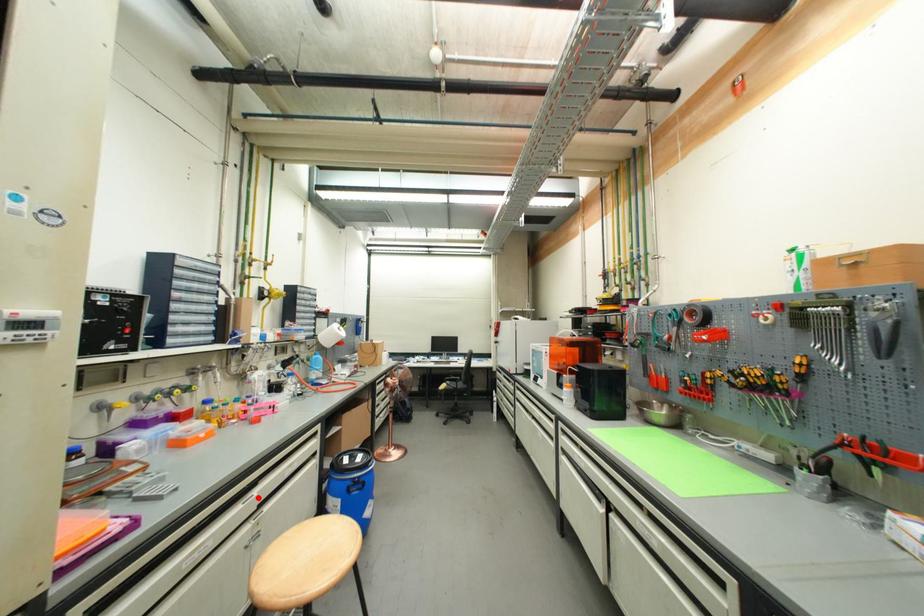
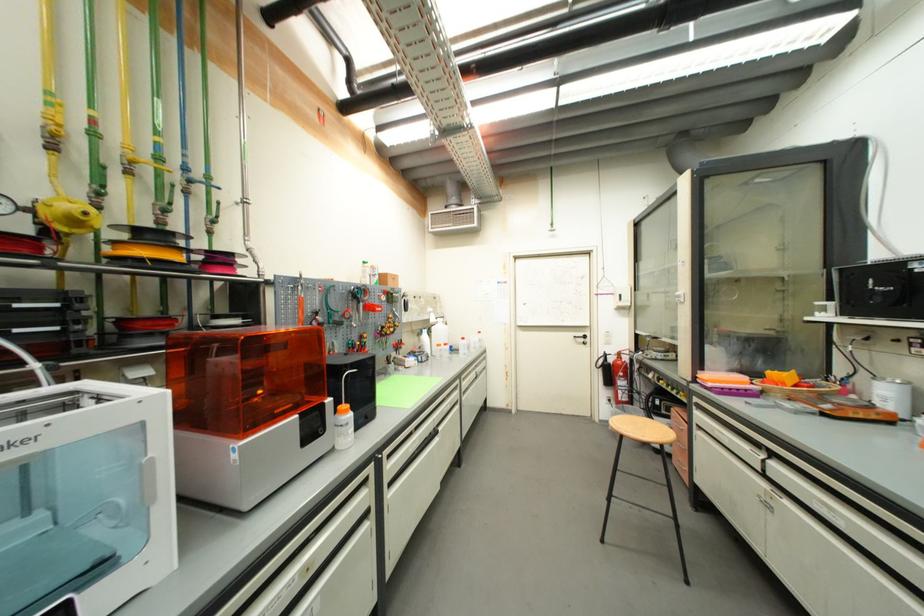
The point at the highlighted location is marked in the first image. Where is the corresponding point in the second image?

(764, 456)